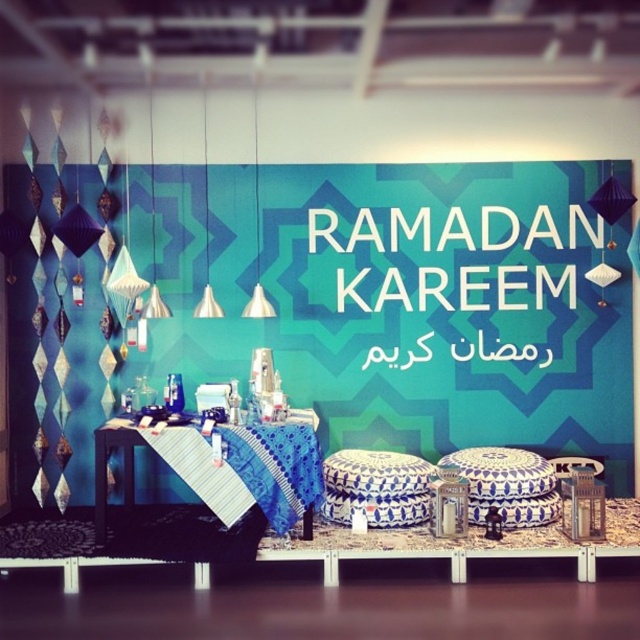
Question: Which of the following is the farthest from the observer?

Choices:
 (A) (172, 433)
 (B) (426, 477)
 (C) (584, 282)

Answer: (C)

Question: Does blue fabric table at center have a greater width compared to blue and white ceramic stool at center?

Choices:
 (A) yes
 (B) no

Answer: (A)

Question: In this image, where is blue fabric table at center located relative to blue and white ceramic stool at center?

Choices:
 (A) above
 (B) below

Answer: (A)

Question: Observing the image, what is the correct spatial positioning of blue fabric at center in reference to blue fabric table at center?

Choices:
 (A) right
 (B) left

Answer: (A)

Question: Which object is the farthest from the teal fabric at center?

Choices:
 (A) blue fabric table at center
 (B) blue and white ceramic stool at center
 (C) blue fabric at center

Answer: (C)

Question: Which of the following is the farthest from the observer?

Choices:
 (A) (198, 436)
 (B) (458, 381)

Answer: (B)